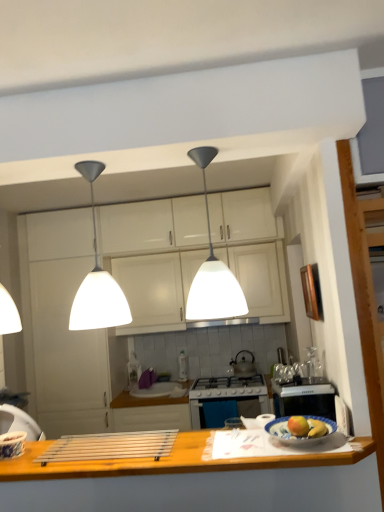
Question: Which direction should I rotate to look at white matte pendant light at center, arranged as the 2th light when viewed from the right, — up or down?

Choices:
 (A) down
 (B) up

Answer: (B)

Question: Can we say metallic silver kettle at center lies outside white glossy cabinets at center, which is the first cabinetry in top-to-bottom order?

Choices:
 (A) yes
 (B) no

Answer: (A)

Question: Is metallic silver kettle at center closer to camera compared to white glossy cabinets at center, the second cabinetry when ordered from bottom to top?

Choices:
 (A) yes
 (B) no

Answer: (B)

Question: Is metallic silver kettle at center taller than white glossy cabinets at center, which is the first cabinetry in top-to-bottom order?

Choices:
 (A) no
 (B) yes

Answer: (A)

Question: Can you confirm if metallic silver kettle at center is thinner than white glossy cabinets at center, which is the first cabinetry in top-to-bottom order?

Choices:
 (A) no
 (B) yes

Answer: (B)

Question: Is metallic silver kettle at center aimed at white glossy cabinets at center, which is the first cabinetry in top-to-bottom order?

Choices:
 (A) no
 (B) yes

Answer: (A)

Question: From the image's perspective, does metallic silver kettle at center appear lower than white glossy cabinets at center, which is the first cabinetry in top-to-bottom order?

Choices:
 (A) no
 (B) yes

Answer: (B)

Question: Is metallic silver faucet at center next to metallic silver kettle at center?

Choices:
 (A) yes
 (B) no

Answer: (B)

Question: Does metallic silver faucet at center have a smaller size compared to metallic silver kettle at center?

Choices:
 (A) yes
 (B) no

Answer: (B)

Question: Does metallic silver faucet at center lie behind metallic silver kettle at center?

Choices:
 (A) no
 (B) yes

Answer: (A)

Question: Does metallic silver faucet at center contain metallic silver kettle at center?

Choices:
 (A) yes
 (B) no

Answer: (B)

Question: Does metallic silver faucet at center lie in front of metallic silver kettle at center?

Choices:
 (A) no
 (B) yes

Answer: (B)

Question: Considering the relative sizes of metallic silver faucet at center and metallic silver kettle at center in the image provided, is metallic silver faucet at center taller than metallic silver kettle at center?

Choices:
 (A) no
 (B) yes

Answer: (A)

Question: From the image's perspective, is white matte cabinet at center, positioned as the second cabinetry in top-to-bottom order, on metallic silver kettle at center?

Choices:
 (A) no
 (B) yes

Answer: (B)